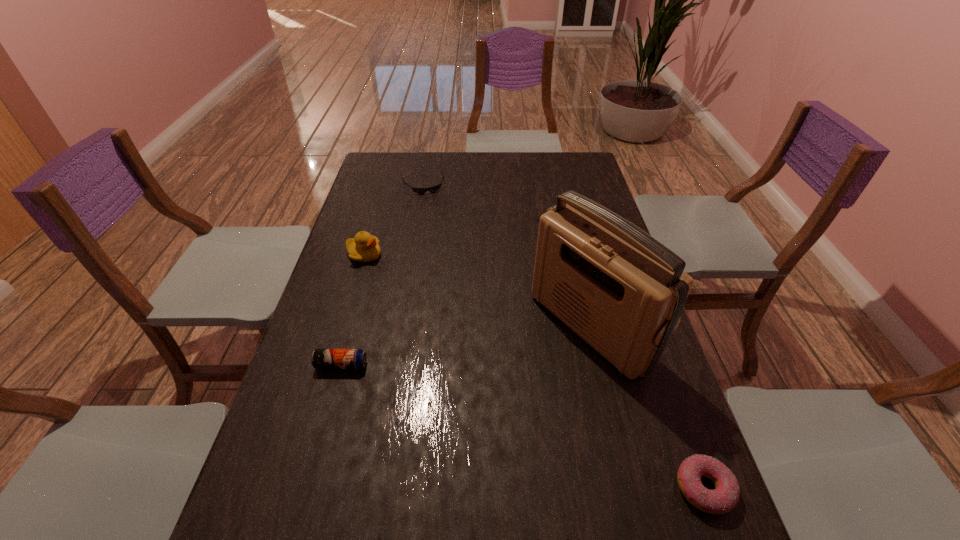
Find the location of a particular element. The image size is (960, 540). unoccupied position between the duckling and the farthest object is located at coordinates (394, 220).

Where is `unoccupied area between the doughnut and the beer can`? This screenshot has height=540, width=960. unoccupied area between the doughnut and the beer can is located at coordinates click(522, 427).

I want to click on vacant space that's between the doughnut and the sunglasses, so click(x=564, y=336).

You are a GUI agent. You are given a task and a screenshot of the screen. Output one action in this format:
    pyautogui.click(x=<x>, y=<y>)
    Task: Click on the blank region between the beer can and the fourth shortest object
    The image size is (960, 540).
    Given the screenshot: What is the action you would take?
    pyautogui.click(x=352, y=310)

Where is `object that is the fourth closest to the radio receiver`? Image resolution: width=960 pixels, height=540 pixels. object that is the fourth closest to the radio receiver is located at coordinates (432, 189).

In order to click on object that is the third closest to the radio receiver in this screenshot , I will do `click(364, 248)`.

Where is `vacant area in the image that satisfies the following two spatial constraints: 1. on the back side of the farthest object; 2. on the left side of the beer can`? vacant area in the image that satisfies the following two spatial constraints: 1. on the back side of the farthest object; 2. on the left side of the beer can is located at coordinates pos(392,185).

Find the location of a particular element. The height and width of the screenshot is (540, 960). free region that satisfies the following two spatial constraints: 1. on the front side of the beer can; 2. on the left side of the doughnut is located at coordinates (307, 488).

At what (x,y) coordinates should I click in order to perform the action: click on vacant point that satisfies the following two spatial constraints: 1. on the front side of the sunglasses; 2. on the left side of the doughnut. Please return your answer as a coordinate pair (x, y). Image resolution: width=960 pixels, height=540 pixels. Looking at the image, I should click on (369, 488).